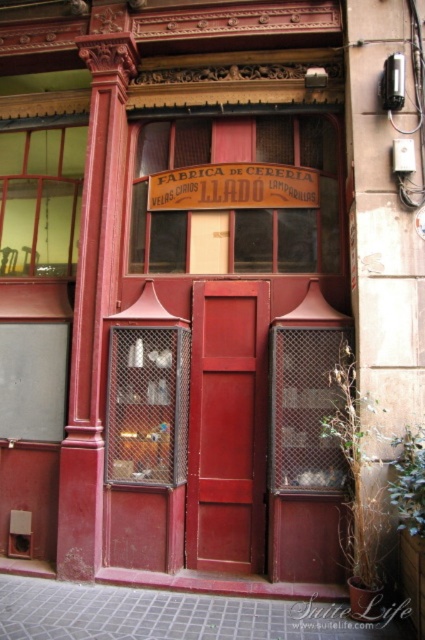
Question: Can you confirm if matte wood door at center is wider than brown wood sign at center?

Choices:
 (A) no
 (B) yes

Answer: (A)

Question: Which point appears farthest from the camera in this image?

Choices:
 (A) (155, 189)
 (B) (254, 518)

Answer: (A)

Question: Considering the relative positions of matte wood door at center and brown wood sign at center in the image provided, where is matte wood door at center located with respect to brown wood sign at center?

Choices:
 (A) right
 (B) left

Answer: (B)

Question: From the image, what is the correct spatial relationship of matte wood door at center in relation to brown wood sign at center?

Choices:
 (A) left
 (B) right

Answer: (A)

Question: Among these objects, which one is farthest from the camera?

Choices:
 (A) brown wood sign at center
 (B) matte wood door at center

Answer: (A)